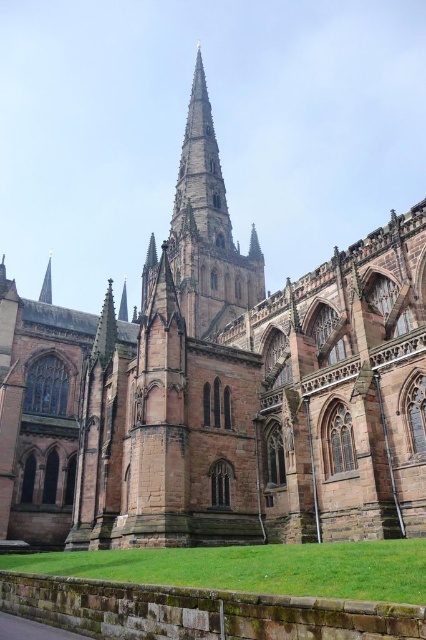
This screenshot has width=426, height=640. What do you see at coordinates (207, 230) in the screenshot? I see `brown stone spire at center` at bounding box center [207, 230].

Image resolution: width=426 pixels, height=640 pixels. I want to click on brown stone spire at center, so click(207, 230).